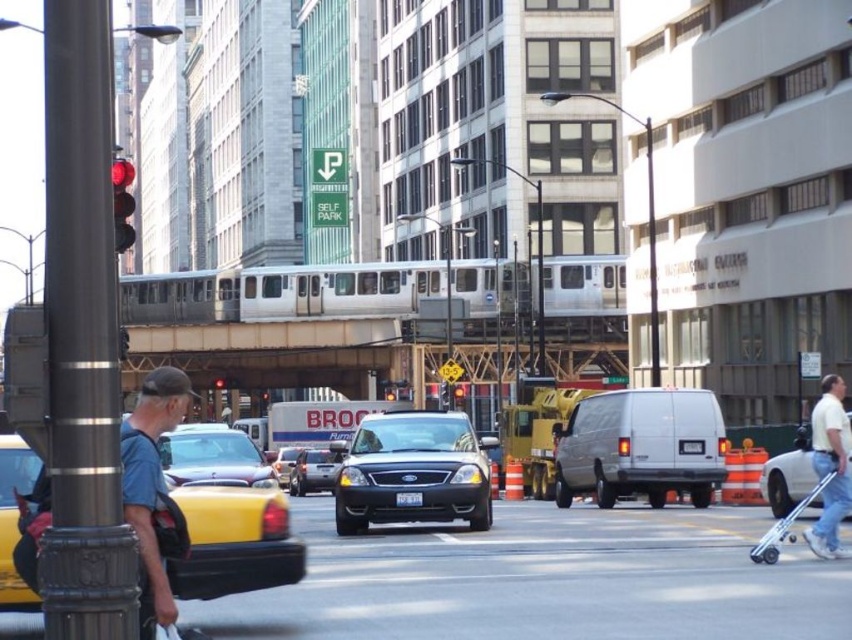
You are a pedestrian standing at the intersection. You see a white cotton shirt at right and a metallic silver sedan at center. Which object is positioned more to the right side of the scene?

The white cotton shirt at right is positioned more to the right side of the scene than the metallic silver sedan at center.

You are a delivery person carrying a package and need to cross the street from the white cotton shirt at right to the metallic silver sedan at center. The safe crossing distance recommended by the city is 30 meters. Can you safely cross the street within the recommended distance?

The distance between the white cotton shirt at right and the metallic silver sedan at center is 37.27 meters, which exceeds the recommended safe crossing distance of 30 meters. Therefore, you cannot safely cross the street within the recommended distance.

You are a delivery driver who needs to park your truck near the white matte van at right. The parking spot you want is located at coordinates point (x=786, y=480). Is this parking spot near the white matte van at right?

Yes, the parking spot at point (x=786, y=480) is near the white matte van at right because the point marks the location of the van.